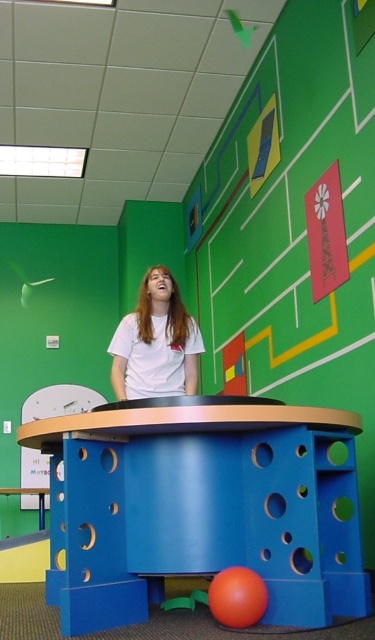
Can you confirm if blue matte table at center is positioned above matte green bulletin board at upper center?

No, blue matte table at center is not above matte green bulletin board at upper center.

The width and height of the screenshot is (375, 640). Describe the element at coordinates (202, 506) in the screenshot. I see `blue matte table at center` at that location.

Measure the distance between blue matte table at center and camera.

blue matte table at center and camera are 2.63 meters apart from each other.

Image resolution: width=375 pixels, height=640 pixels. What are the coordinates of `blue matte table at center` in the screenshot? It's located at (202, 506).

Between point (235, 305) and point (144, 326), which one is positioned behind?

Positioned behind is point (235, 305).

Locate an element on the screen. The height and width of the screenshot is (640, 375). matte green bulletin board at upper center is located at coordinates (292, 230).

Locate an element on the screen. Image resolution: width=375 pixels, height=640 pixels. matte green bulletin board at upper center is located at coordinates (292, 230).

What are the coordinates of `matte green bulletin board at upper center` in the screenshot? It's located at (292, 230).

Which is behind, point (310, 612) or point (163, 349)?

Positioned behind is point (163, 349).

Which is in front, point (61, 605) or point (166, 371)?

Point (61, 605) is in front.

Image resolution: width=375 pixels, height=640 pixels. Identify the location of blue matte table at center. (202, 506).